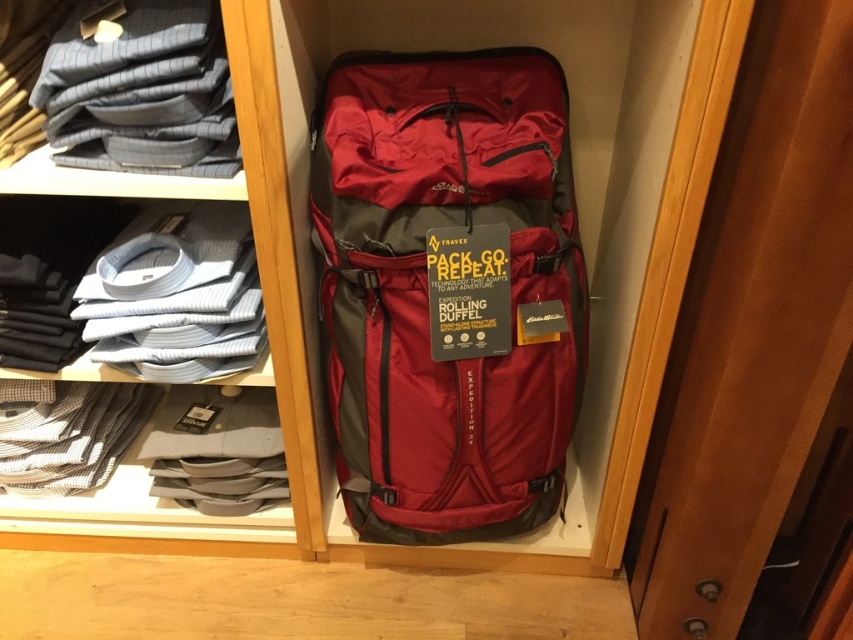
You are packing for a trip and need to decide whether the matte red duffel bag at center can accommodate the gray striped shirt at upper left. Based on their sizes, will the shirt fit inside the duffel bag?

The matte red duffel bag at center is taller than the gray striped shirt at upper left, so the shirt should fit inside the duffel bag as it is shorter than the bag.

You are packing for a trip and see the matte gray shirts at left and the gray striped shirt at upper left in your closet. Which shirt is located more to the right side?

The matte gray shirts at left is positioned on the right side of gray striped shirt at upper left, so it is more to the right.